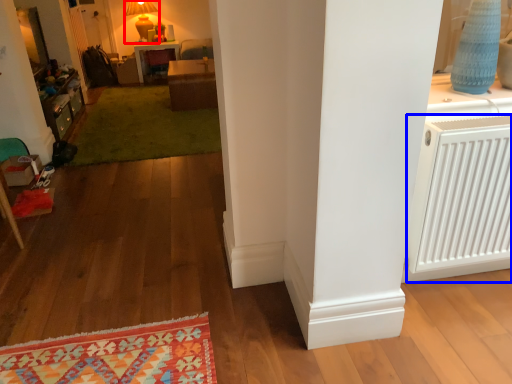
Question: Which of the following is the closest to the observer, lamp (highlighted by a red box) or air conditioning (highlighted by a blue box)?

Choices:
 (A) lamp
 (B) air conditioning

Answer: (B)